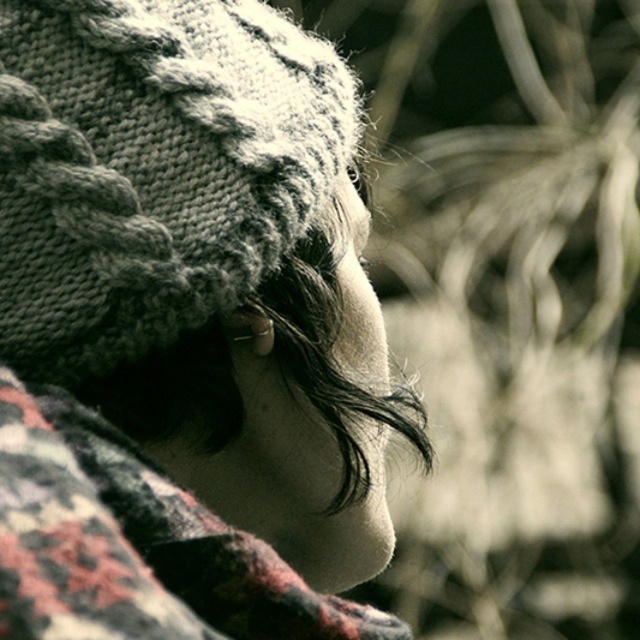
Question: Can you confirm if knitted gray hat at upper left is positioned below plaid wool shawl at center?

Choices:
 (A) yes
 (B) no

Answer: (B)

Question: Which point is farther to the camera?

Choices:
 (A) knitted gray hat at upper left
 (B) knitted woolen hat at upper left

Answer: (A)

Question: Which of the following is the farthest from the observer?

Choices:
 (A) plaid wool shawl at center
 (B) knitted woolen hat at upper left

Answer: (B)

Question: Which of the following is the farthest from the observer?

Choices:
 (A) (148, 588)
 (B) (35, 1)

Answer: (B)

Question: Does knitted woolen hat at upper left appear on the right side of knitted gray hat at upper left?

Choices:
 (A) yes
 (B) no

Answer: (A)

Question: Is knitted woolen hat at upper left bigger than knitted gray hat at upper left?

Choices:
 (A) no
 (B) yes

Answer: (B)